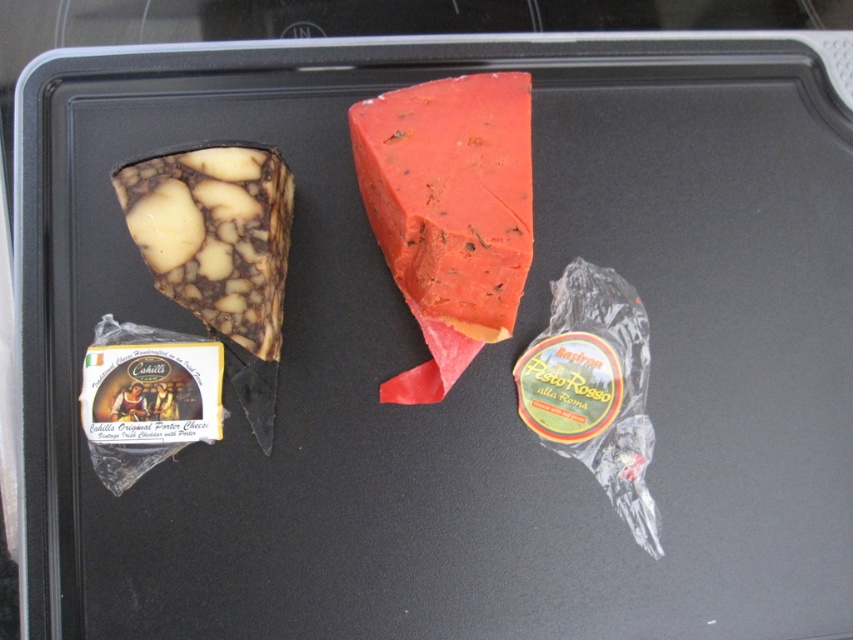
Question: Is red matte cheese at center positioned at the back of translucent plastic pesto rosso at center?

Choices:
 (A) yes
 (B) no

Answer: (B)

Question: Is marbled cheese at left closer to camera compared to translucent plastic pesto rosso at center?

Choices:
 (A) no
 (B) yes

Answer: (B)

Question: Estimate the real-world distances between objects in this image. Which object is closer to the translucent plastic pesto rosso at center?

Choices:
 (A) red matte cheese at center
 (B) marbled cheese at left

Answer: (A)

Question: Which point is closer to the camera?

Choices:
 (A) translucent plastic pesto rosso at center
 (B) red matte cheese at center
 (C) marbled cheese at left

Answer: (C)

Question: Is red matte cheese at center closer to the viewer compared to marbled cheese at left?

Choices:
 (A) yes
 (B) no

Answer: (B)

Question: Which object is closer to the camera taking this photo?

Choices:
 (A) marbled cheese at left
 (B) red matte cheese at center

Answer: (A)